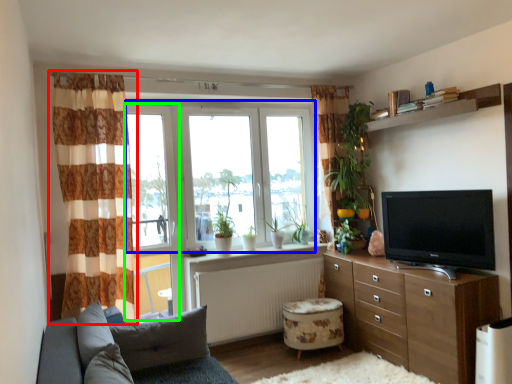
Question: Which object is the farthest from curtain (highlighted by a red box)? Choose among these: window screen (highlighted by a blue box) or window frame (highlighted by a green box).

Choices:
 (A) window screen
 (B) window frame

Answer: (A)